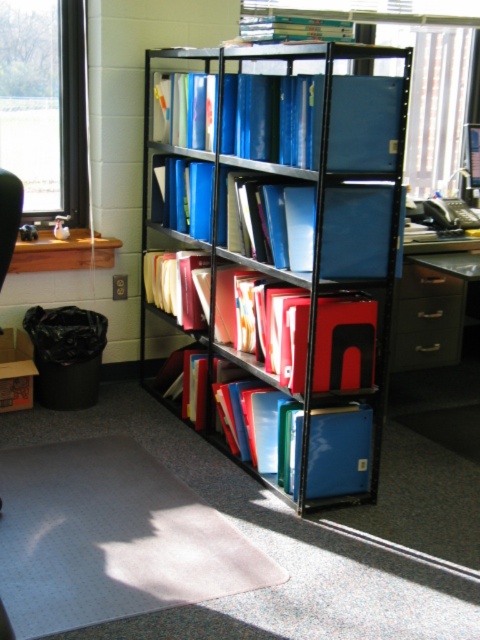
What do you see at coordinates (425, 317) in the screenshot? This screenshot has height=640, width=480. I see `black plastic drawer at right` at bounding box center [425, 317].

Is black plastic drawer at right to the right of metallic silver drawer at lower right from the viewer's perspective?

No, black plastic drawer at right is not to the right of metallic silver drawer at lower right.

Which is in front, point (405, 314) or point (420, 353)?

Positioned in front is point (405, 314).

The image size is (480, 640). What are the coordinates of `black plastic drawer at right` in the screenshot? It's located at (425, 317).

Is metallic gray computer desk at center wider than metallic silver drawer at lower right?

Indeed, metallic gray computer desk at center has a greater width compared to metallic silver drawer at lower right.

Identify the location of metallic gray computer desk at center. This screenshot has height=640, width=480. (427, 339).

Is point (441, 289) closer to viewer compared to point (412, 348)?

That is False.

The width and height of the screenshot is (480, 640). Identify the location of metallic gray computer desk at center. (427, 339).

Which is above, matte yellow folder at center or metallic drawer at center?

matte yellow folder at center

Is matte yellow folder at center taller than metallic drawer at center?

Yes.

Is point (182, 324) less distant than point (452, 314)?

That is True.

Locate an element on the screen. The width and height of the screenshot is (480, 640). matte yellow folder at center is located at coordinates (175, 284).